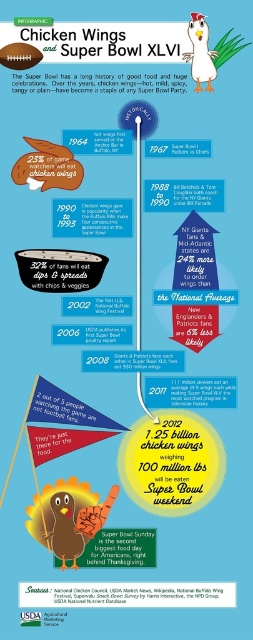
Is brown matte turkey at center to the right of matte brown chicken wings at upper left from the viewer's perspective?

Yes, brown matte turkey at center is to the right of matte brown chicken wings at upper left.

Who is higher up, brown matte turkey at center or matte brown chicken wings at upper left?

Positioned higher is matte brown chicken wings at upper left.

The image size is (253, 640). I want to click on brown matte turkey at center, so click(68, 516).